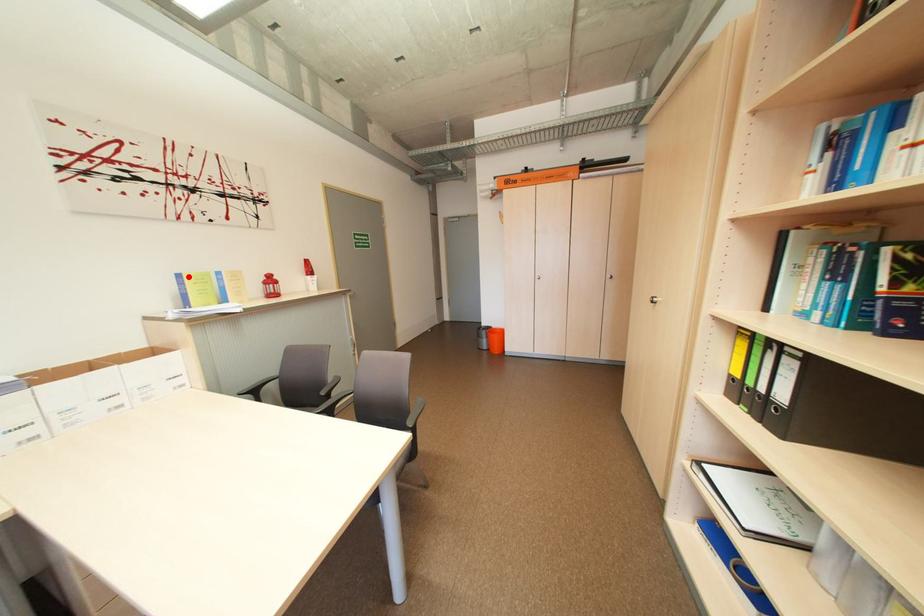
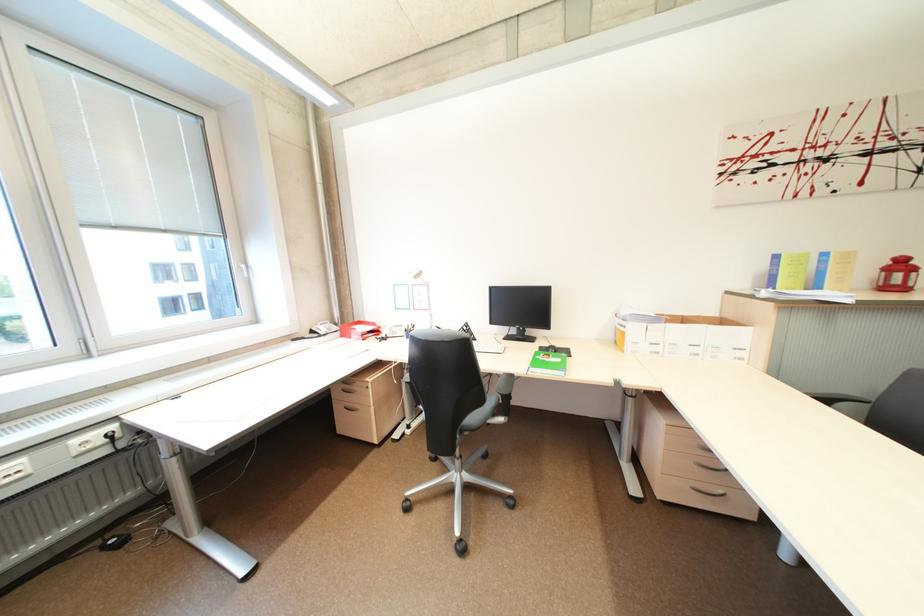
The point at the highlighted location is marked in the first image. Where is the corresponding point in the second image?

(785, 257)